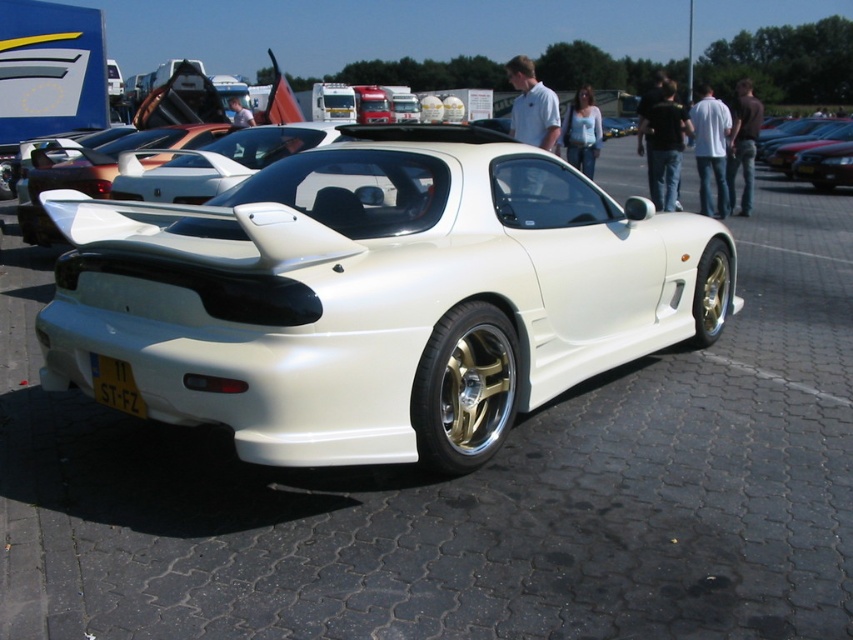
Can you confirm if yellow matte license plate at lower center is positioned to the left of white metallic car at center?

Indeed, yellow matte license plate at lower center is positioned on the left side of white metallic car at center.

Which is more to the right, yellow matte license plate at lower center or white metallic car at center?

Positioned to the right is white metallic car at center.

Does point (113, 392) come behind point (828, 125)?

That is False.

Find the location of a particular element. This screenshot has height=640, width=853. yellow matte license plate at lower center is located at coordinates (115, 385).